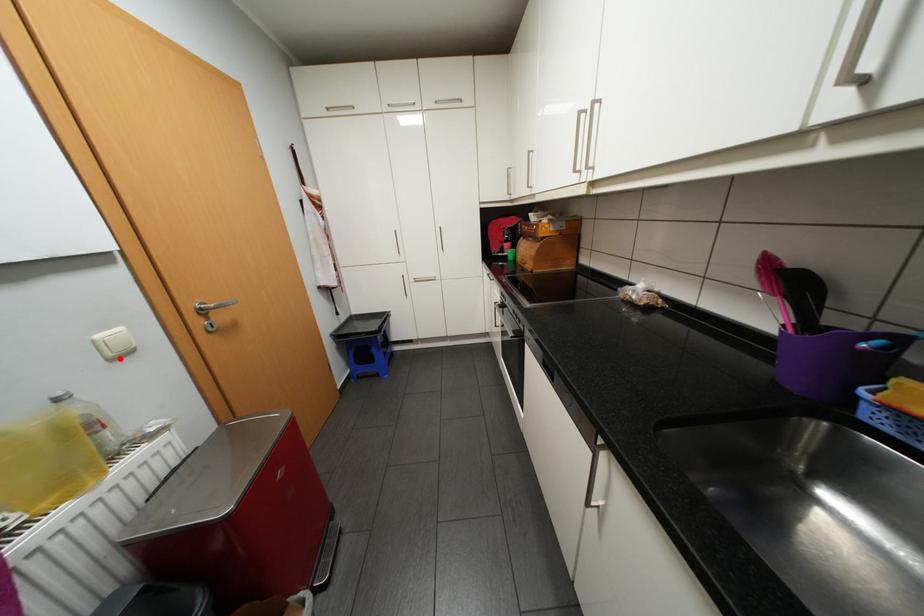
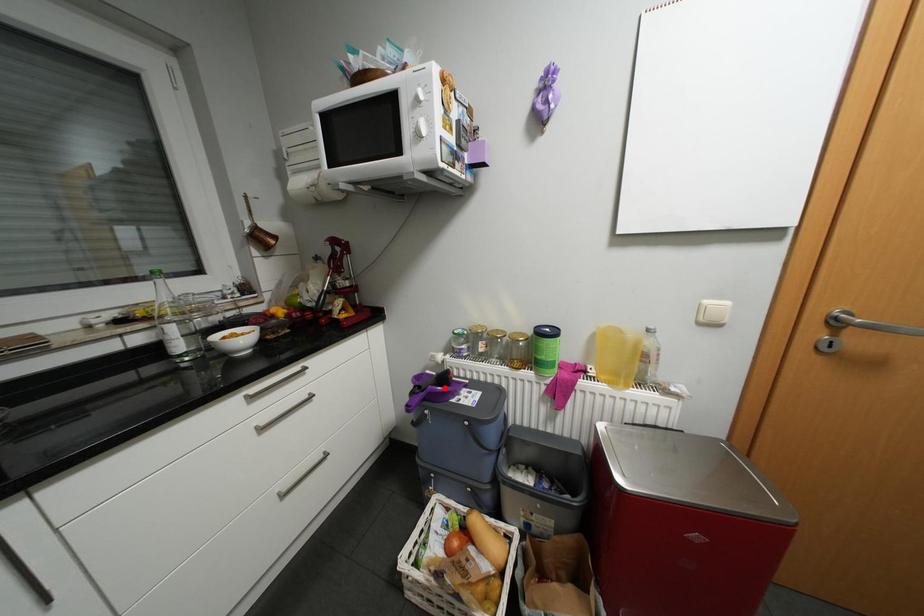
I am providing you with two images of the same scene from different viewpoints. A red point is marked on the first image and another point is marked on the second image. Do the highlighted points in image1 and image2 indicate the same real-world spot?

No